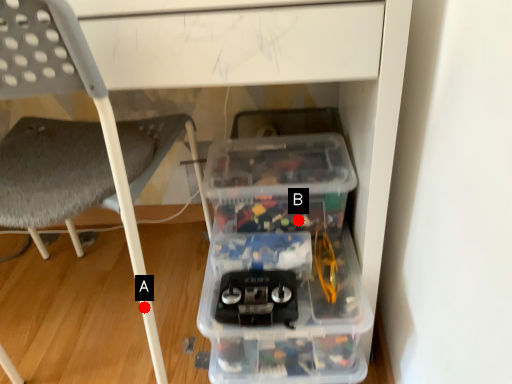
Question: Two points are circled on the image, labeled by A and B beside each circle. Which point is further to the camera?

Choices:
 (A) A is further
 (B) B is further

Answer: (B)